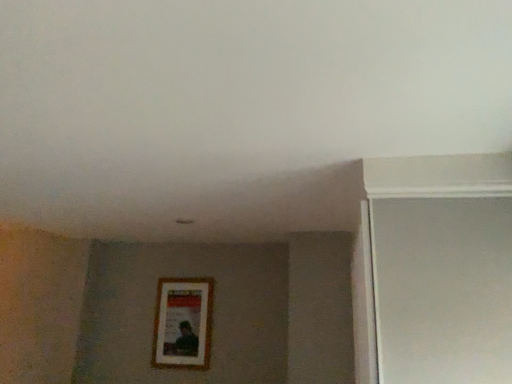
Question: From their relative heights in the image, would you say white matte screen door at right is taller or shorter than wooden picture frame at center?

Choices:
 (A) short
 (B) tall

Answer: (B)

Question: Looking at the image, does white matte screen door at right seem bigger or smaller compared to wooden picture frame at center?

Choices:
 (A) big
 (B) small

Answer: (A)

Question: From a real-world perspective, relative to wooden picture frame at center, is white matte screen door at right vertically above or below?

Choices:
 (A) below
 (B) above

Answer: (B)

Question: From a real-world perspective, is wooden picture frame at center above or below white matte screen door at right?

Choices:
 (A) below
 (B) above

Answer: (A)

Question: From the image's perspective, is wooden picture frame at center above or below white matte screen door at right?

Choices:
 (A) above
 (B) below

Answer: (B)

Question: Is wooden picture frame at center inside the boundaries of white matte screen door at right, or outside?

Choices:
 (A) inside
 (B) outside

Answer: (B)

Question: Does point (168, 336) appear closer or farther from the camera than point (425, 281)?

Choices:
 (A) farther
 (B) closer

Answer: (A)